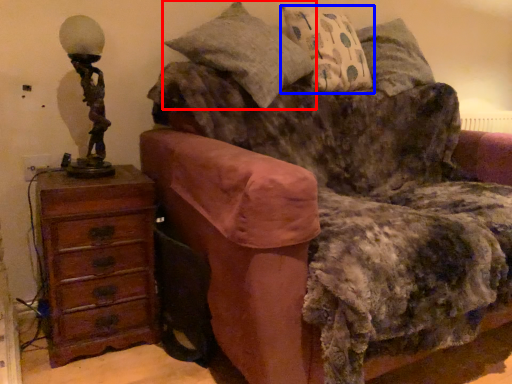
Question: Which object appears closest to the camera in this image, pillow (highlighted by a red box) or pillow (highlighted by a blue box)?

Choices:
 (A) pillow
 (B) pillow

Answer: (A)